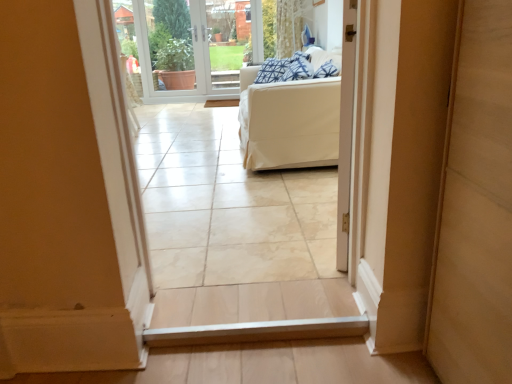
What do you see at coordinates (298, 68) in the screenshot? The image size is (512, 384). I see `blue patterned pillow at upper center` at bounding box center [298, 68].

Where is `white plastic window screen at upper center`? white plastic window screen at upper center is located at coordinates (196, 46).

Describe the element at coordinates (196, 46) in the screenshot. Image resolution: width=512 pixels, height=384 pixels. I see `white plastic window screen at upper center` at that location.

What are the coordinates of `blue patterned pillow at upper center` in the screenshot? It's located at tap(298, 68).

Is white fabric couch at center looking in the opposite direction of white plastic window screen at upper center?

No, white fabric couch at center's orientation is not away from white plastic window screen at upper center.

Can you confirm if white fabric couch at center is shorter than white plastic window screen at upper center?

Yes.

Would you say white fabric couch at center is to the left or to the right of white plastic window screen at upper center in the picture?

From the image, it's evident that white fabric couch at center is to the right of white plastic window screen at upper center.

Is white plastic window screen at upper center in front of or behind white fabric couch at center in the image?

white plastic window screen at upper center is positioned farther from the viewer than white fabric couch at center.

Looking at the image, does white plastic window screen at upper center seem bigger or smaller compared to white fabric couch at center?

Considering their sizes, white plastic window screen at upper center takes up less space than white fabric couch at center.

How distant is white plastic window screen at upper center from white fabric couch at center?

The distance of white plastic window screen at upper center from white fabric couch at center is 2.87 meters.

Is point (247, 20) positioned after point (259, 97)?

Yes, it is behind point (259, 97).

Can you confirm if blue patterned pillow at upper center is wider than white fabric couch at center?

In fact, blue patterned pillow at upper center might be narrower than white fabric couch at center.

Is blue patterned pillow at upper center to the right of white fabric couch at center from the viewer's perspective?

Yes, blue patterned pillow at upper center is to the right of white fabric couch at center.

Does blue patterned pillow at upper center touch white fabric couch at center?

No, blue patterned pillow at upper center is not making contact with white fabric couch at center.

Can you tell me how much blue patterned pillow at upper center and white fabric couch at center differ in facing direction?

8.04 degrees separate the facing orientations of blue patterned pillow at upper center and white fabric couch at center.

Is transparent glass door at center behind white plastic window screen at upper center?

Yes, the depth of transparent glass door at center is greater than that of white plastic window screen at upper center.

How distant is transparent glass door at center from white plastic window screen at upper center?

transparent glass door at center and white plastic window screen at upper center are 8.11 inches apart from each other.

How different are the orientations of transparent glass door at center and white plastic window screen at upper center in degrees?

0.0038 degrees separate the facing orientations of transparent glass door at center and white plastic window screen at upper center.

Considering the relative sizes of transparent glass door at center and white plastic window screen at upper center in the image provided, is transparent glass door at center bigger than white plastic window screen at upper center?

Incorrect, transparent glass door at center is not larger than white plastic window screen at upper center.

Which of these two, white plastic window screen at upper center or transparent glass door at center, stands taller?

Standing taller between the two is white plastic window screen at upper center.

Between point (148, 20) and point (230, 53), which one is positioned behind?

The point (148, 20) is farther.

Which object is thinner, white plastic window screen at upper center or transparent glass door at center?

white plastic window screen at upper center.

Which is in front, point (221, 47) or point (300, 51)?

Point (300, 51)

From the image's perspective, is transparent glass door at center located above or below blue patterned pillow at upper center?

Clearly, from the image's perspective, transparent glass door at center is above blue patterned pillow at upper center.

Between transparent glass door at center and blue patterned pillow at upper center, which one has more height?

transparent glass door at center is taller.

Is blue patterned pillow at upper center inside transparent glass door at center?

No, blue patterned pillow at upper center is not surrounded by transparent glass door at center.

From the image's perspective, is white fabric couch at center above transparent glass door at center?

Incorrect, from the image's perspective, white fabric couch at center is lower than transparent glass door at center.

Is white fabric couch at center positioned behind transparent glass door at center?

No, it is in front of transparent glass door at center.

The height and width of the screenshot is (384, 512). I want to click on glass door above the white fabric couch at center (from a real-world perspective), so click(228, 41).

What's the angular difference between white fabric couch at center and transparent glass door at center's facing directions?

There is a 89-degree angle between the facing directions of white fabric couch at center and transparent glass door at center.

Where is `window screen on the left side of white fabric couch at center`? The width and height of the screenshot is (512, 384). window screen on the left side of white fabric couch at center is located at coordinates 196,46.

In order to click on studio couch on the right of white plastic window screen at upper center in this screenshot , I will do `click(289, 122)`.

Estimate the real-world distances between objects in this image. Which object is closer to white plastic window screen at upper center, white fabric couch at center or blue patterned pillow at upper center?

Based on the image, blue patterned pillow at upper center appears to be nearer to white plastic window screen at upper center.

From the image, which object appears to be farther from transparent glass door at center, blue patterned pillow at upper center or white fabric couch at center?

Among the two, white fabric couch at center is located further to transparent glass door at center.

Looking at the image, which one is located closer to white fabric couch at center, transparent glass door at center or blue patterned pillow at upper center?

blue patterned pillow at upper center.

Estimate the real-world distances between objects in this image. Which object is closer to transparent glass door at center, white fabric couch at center or blue patterned pillow at upper center?

blue patterned pillow at upper center lies closer to transparent glass door at center than the other object.

Considering their positions, is white plastic window screen at upper center positioned further to white fabric couch at center than blue patterned pillow at upper center?

Based on the image, white plastic window screen at upper center appears to be further to white fabric couch at center.

Which object lies nearer to the anchor point white plastic window screen at upper center, white fabric couch at center or transparent glass door at center?

Based on the image, transparent glass door at center appears to be nearer to white plastic window screen at upper center.

Looking at the image, which one is located further to blue patterned pillow at upper center, white fabric couch at center or transparent glass door at center?

The object further to blue patterned pillow at upper center is transparent glass door at center.

Based on their spatial positions, is transparent glass door at center or white plastic window screen at upper center further from white fabric couch at center?

Based on the image, white plastic window screen at upper center appears to be further to white fabric couch at center.

Image resolution: width=512 pixels, height=384 pixels. What are the coordinates of `pillow between white fabric couch at center and transparent glass door at center along the z-axis` in the screenshot? It's located at (298, 68).

Locate an element on the screen. The height and width of the screenshot is (384, 512). window screen between white fabric couch at center and transparent glass door at center along the z-axis is located at coordinates (196, 46).

The width and height of the screenshot is (512, 384). Find the location of `pillow between white fabric couch at center and white plastic window screen at upper center in the front-back direction`. pillow between white fabric couch at center and white plastic window screen at upper center in the front-back direction is located at coordinates tap(298, 68).

At what (x,y) coordinates should I click in order to perform the action: click on window screen positioned between blue patterned pillow at upper center and transparent glass door at center from near to far. Please return your answer as a coordinate pair (x, y). Looking at the image, I should click on (x=196, y=46).